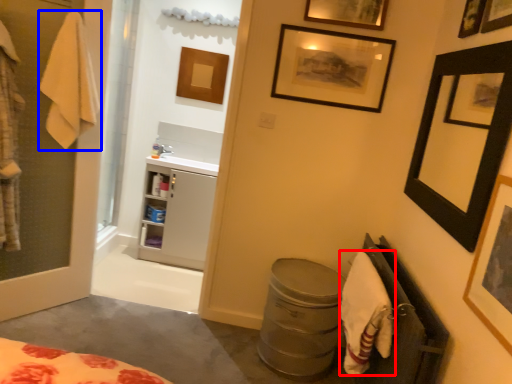
Question: Which object is closer to the camera taking this photo, bath towel (highlighted by a red box) or bath towel (highlighted by a blue box)?

Choices:
 (A) bath towel
 (B) bath towel

Answer: (A)